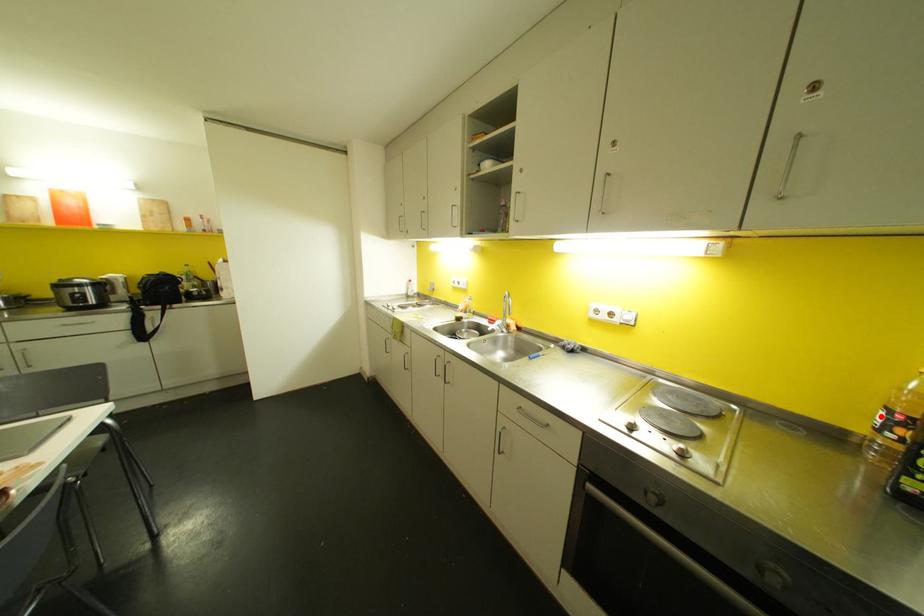
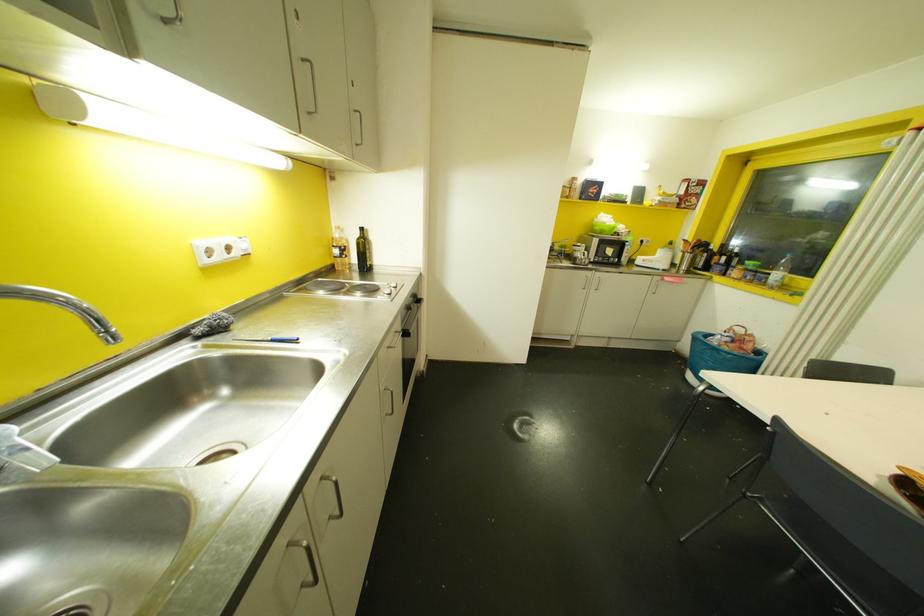
Question: I am providing you with two images of the same scene from different viewpoints. Given a red point in image1, look at the same physical point in image2. Is it:

Choices:
 (A) Closer to the viewpoint
 (B) Farther from the viewpoint

Answer: (A)